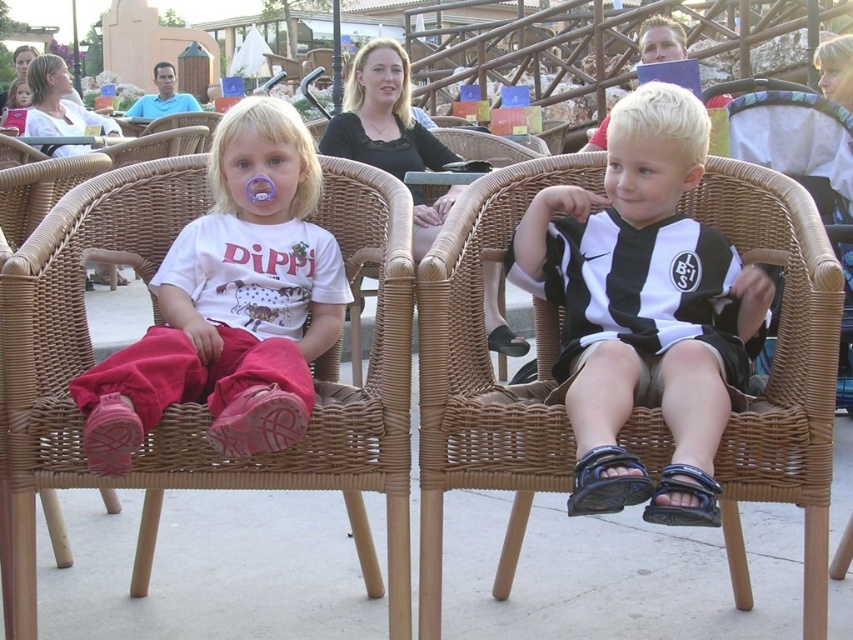
Describe the element at coordinates (643, 308) in the screenshot. I see `black and white jersey at center` at that location.

Does black and white jersey at center have a greater height compared to matte white shirt at center?

Yes, black and white jersey at center is taller than matte white shirt at center.

This screenshot has height=640, width=853. Describe the element at coordinates (643, 308) in the screenshot. I see `black and white jersey at center` at that location.

Where is `black and white jersey at center`? black and white jersey at center is located at coordinates pyautogui.click(x=643, y=308).

Who is lower down, brown wicker chair at center or matte white shirt at center?

brown wicker chair at center is below.

Is brown wicker chair at center positioned behind matte white shirt at center?

Yes.

Is point (463, 278) positioned behind point (262, 221)?

No, it is not.

Locate an element on the screen. brown wicker chair at center is located at coordinates (485, 376).

Who is higher up, woven wood chair at left or matte white shirt at center?

matte white shirt at center is higher up.

Is woven wood chair at left thinner than matte white shirt at center?

No.

Who is more forward, (10, 449) or (201, 349)?

Point (10, 449) is more forward.

This screenshot has width=853, height=640. In order to click on woven wood chair at left in this screenshot , I will do `click(192, 404)`.